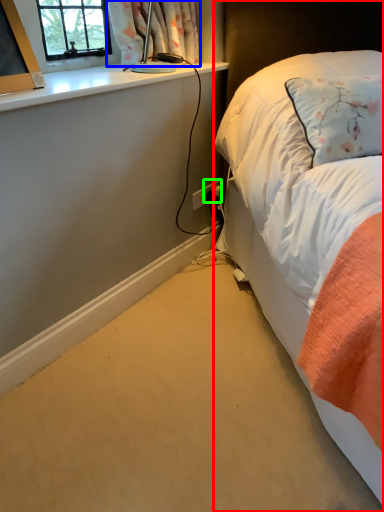
Question: Based on their relative distances, which object is nearer to bed (highlighted by a red box)? Choose from curtain (highlighted by a blue box) and power plugs and sockets (highlighted by a green box).

Choices:
 (A) curtain
 (B) power plugs and sockets

Answer: (A)